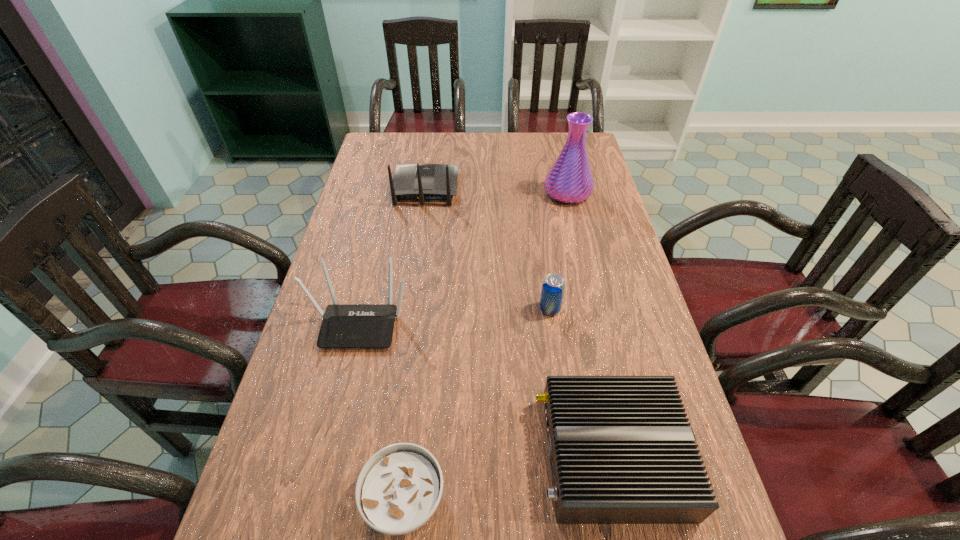
Where is `the third closest router relative to the beer can`? The height and width of the screenshot is (540, 960). the third closest router relative to the beer can is located at coordinates (421, 182).

This screenshot has height=540, width=960. Identify the location of blank area in the image that satisfies the following two spatial constraints: 1. on the back side of the vase; 2. on the left side of the beer can. (534, 193).